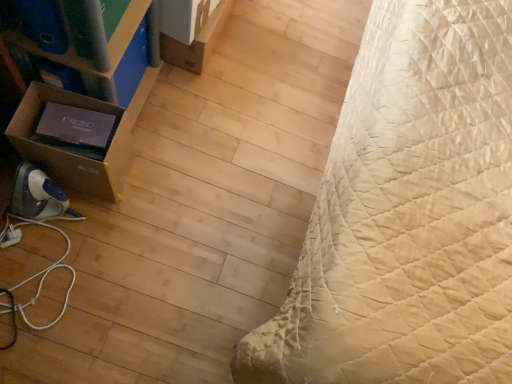
What do you see at coordinates (70, 149) in the screenshot?
I see `brown cardboard box at left, placed as the 1th cardboard box when sorted from front to back` at bounding box center [70, 149].

Where is `beige quilted bed at right`? Image resolution: width=512 pixels, height=384 pixels. beige quilted bed at right is located at coordinates (407, 214).

I want to click on brown cardboard box at left, arranged as the 1th cardboard box when ordered from the bottom, so click(x=70, y=149).

Considering the relative positions of matte cardboard box at left and brown cardboard box at left, placed as the second cardboard box when sorted from back to front, in the image provided, is matte cardboard box at left to the right of brown cardboard box at left, placed as the second cardboard box when sorted from back to front, from the viewer's perspective?

Correct, you'll find matte cardboard box at left to the right of brown cardboard box at left, placed as the second cardboard box when sorted from back to front.

From the picture: Which of these two, matte cardboard box at left or brown cardboard box at left, placed as the 1th cardboard box when sorted from front to back, stands taller?

Standing taller between the two is matte cardboard box at left.

Considering the points (16, 19) and (76, 182), which point is in front, point (16, 19) or point (76, 182)?

The point (16, 19) is closer.

Does beige quilted bed at right turn towards brown cardboard box at upper left, arranged as the first cardboard box when viewed from the top?

No, beige quilted bed at right is not aimed at brown cardboard box at upper left, arranged as the first cardboard box when viewed from the top.

Which object is wider, beige quilted bed at right or brown cardboard box at upper left, the 1th cardboard box when ordered from back to front?

beige quilted bed at right is wider.

Is beige quilted bed at right to the left of brown cardboard box at upper left, arranged as the first cardboard box when viewed from the top, from the viewer's perspective?

No, beige quilted bed at right is not to the left of brown cardboard box at upper left, arranged as the first cardboard box when viewed from the top.

From a real-world perspective, is beige quilted bed at right positioned under brown cardboard box at upper left, acting as the 2th cardboard box starting from the front, based on gravity?

No.

Is brown cardboard box at left, arranged as the second cardboard box when viewed from the right, smaller than matte cardboard box at left?

Yes, brown cardboard box at left, arranged as the second cardboard box when viewed from the right, is smaller than matte cardboard box at left.

Does brown cardboard box at left, placed as the 1th cardboard box when sorted from front to back, have a lesser width compared to matte cardboard box at left?

Yes, brown cardboard box at left, placed as the 1th cardboard box when sorted from front to back, is thinner than matte cardboard box at left.

Would you consider brown cardboard box at left, placed as the 1th cardboard box when sorted from front to back, to be distant from matte cardboard box at left?

No, brown cardboard box at left, placed as the 1th cardboard box when sorted from front to back, is not far from matte cardboard box at left.

From their relative heights in the image, would you say brown cardboard box at left, placed as the second cardboard box when sorted from back to front, is taller or shorter than matte cardboard box at left?

Clearly, brown cardboard box at left, placed as the second cardboard box when sorted from back to front, is shorter compared to matte cardboard box at left.

Which of these two, matte cardboard box at left or brown cardboard box at upper left, the 1th cardboard box when ordered from back to front, is smaller?

brown cardboard box at upper left, the 1th cardboard box when ordered from back to front.

Could you measure the distance between matte cardboard box at left and brown cardboard box at upper left, arranged as the 2th cardboard box when ordered from the bottom?

matte cardboard box at left and brown cardboard box at upper left, arranged as the 2th cardboard box when ordered from the bottom, are 14.30 inches apart.

Is point (25, 143) closer or farther from the camera than point (194, 55)?

Point (25, 143) is closer to the camera than point (194, 55).

Locate an element on the screen. cardboard box that is the 2nd one when counting backward from the matte cardboard box at left is located at coordinates (196, 42).

Is brown cardboard box at left, which appears as the 1th cardboard box when viewed from the left, not within brown cardboard box at upper left, the second cardboard box from the left?

Absolutely, brown cardboard box at left, which appears as the 1th cardboard box when viewed from the left, is external to brown cardboard box at upper left, the second cardboard box from the left.

Between brown cardboard box at left, which appears as the 1th cardboard box when viewed from the left, and brown cardboard box at upper left, arranged as the first cardboard box when viewed from the top, which one has larger size?

brown cardboard box at left, which appears as the 1th cardboard box when viewed from the left, is bigger.

Considering the sizes of brown cardboard box at left, arranged as the 1th cardboard box when ordered from the bottom, and brown cardboard box at upper left, arranged as the 2th cardboard box when ordered from the bottom, in the image, is brown cardboard box at left, arranged as the 1th cardboard box when ordered from the bottom, taller or shorter than brown cardboard box at upper left, arranged as the 2th cardboard box when ordered from the bottom,?

In the image, brown cardboard box at left, arranged as the 1th cardboard box when ordered from the bottom, appears to be taller than brown cardboard box at upper left, arranged as the 2th cardboard box when ordered from the bottom.

Considering the relative positions of brown cardboard box at left, placed as the second cardboard box when sorted from back to front, and brown cardboard box at upper left, acting as the 2th cardboard box starting from the front, in the image provided, is brown cardboard box at left, placed as the second cardboard box when sorted from back to front, behind brown cardboard box at upper left, acting as the 2th cardboard box starting from the front,?

No, brown cardboard box at left, placed as the second cardboard box when sorted from back to front, is in front of brown cardboard box at upper left, acting as the 2th cardboard box starting from the front.

In the image, is beige quilted bed at right on the left side or the right side of matte cardboard box at left?

beige quilted bed at right is to the right of matte cardboard box at left.

Is beige quilted bed at right positioned far away from matte cardboard box at left?

beige quilted bed at right is near matte cardboard box at left, not far away.

Where is `bed positioned vertically above the matte cardboard box at left (from a real-world perspective)`? This screenshot has width=512, height=384. bed positioned vertically above the matte cardboard box at left (from a real-world perspective) is located at coordinates (407, 214).

Which cardboard box is the 1st one when counting from the back of the beige quilted bed at right? Please provide its 2D coordinates.

[(70, 149)]

Is beige quilted bed at right in front of or behind brown cardboard box at left, acting as the second cardboard box starting from the top, in the image?

Clearly, beige quilted bed at right is in front of brown cardboard box at left, acting as the second cardboard box starting from the top.

From a real-world perspective, between beige quilted bed at right and brown cardboard box at left, placed as the 1th cardboard box when sorted from front to back, who is vertically higher?

From a 3D spatial view, beige quilted bed at right is above.

Does beige quilted bed at right appear on the left side of brown cardboard box at left, arranged as the 1th cardboard box when ordered from the bottom?

No.

Find the location of a particular element. the 1st cardboard box behind the matte cardboard box at left, counting from the anchor's position is located at coordinates (70, 149).

Locate an element on the screen. Image resolution: width=512 pixels, height=384 pixels. bed lying below the brown cardboard box at upper left, arranged as the first cardboard box when viewed from the top (from the image's perspective) is located at coordinates (407, 214).

Based on the photo, which object lies nearer to the anchor point matte cardboard box at left, brown cardboard box at upper left, the second cardboard box from the left, or beige quilted bed at right?

brown cardboard box at upper left, the second cardboard box from the left, is positioned closer to the anchor matte cardboard box at left.

Estimate the real-world distances between objects in this image. Which object is closer to matte cardboard box at left, beige quilted bed at right or brown cardboard box at upper left, arranged as the first cardboard box when viewed from the top?

Among the two, brown cardboard box at upper left, arranged as the first cardboard box when viewed from the top, is located nearer to matte cardboard box at left.

From the image, which object appears to be nearer to brown cardboard box at left, placed as the 1th cardboard box when sorted from front to back, matte cardboard box at left or beige quilted bed at right?

matte cardboard box at left is positioned closer to the anchor brown cardboard box at left, placed as the 1th cardboard box when sorted from front to back.

Estimate the real-world distances between objects in this image. Which object is further from matte cardboard box at left, brown cardboard box at left, placed as the 1th cardboard box when sorted from front to back, or brown cardboard box at upper left, the 1th cardboard box when ordered from back to front?

brown cardboard box at upper left, the 1th cardboard box when ordered from back to front, lies further to matte cardboard box at left than the other object.

Which object lies nearer to the anchor point matte cardboard box at left, beige quilted bed at right or brown cardboard box at left, placed as the 1th cardboard box when sorted from front to back?

Based on the image, brown cardboard box at left, placed as the 1th cardboard box when sorted from front to back, appears to be nearer to matte cardboard box at left.

When comparing their distances from brown cardboard box at upper left, arranged as the 2th cardboard box when ordered from the bottom, does beige quilted bed at right or matte cardboard box at left seem closer?

matte cardboard box at left is closer to brown cardboard box at upper left, arranged as the 2th cardboard box when ordered from the bottom.

Estimate the real-world distances between objects in this image. Which object is closer to beige quilted bed at right, brown cardboard box at upper left, acting as the 2th cardboard box starting from the front, or brown cardboard box at left, arranged as the 1th cardboard box when ordered from the bottom?

The object closer to beige quilted bed at right is brown cardboard box at left, arranged as the 1th cardboard box when ordered from the bottom.

Which object lies further to the anchor point brown cardboard box at upper left, the first cardboard box from the right, brown cardboard box at left, arranged as the 1th cardboard box when ordered from the bottom, or beige quilted bed at right?

Among the two, beige quilted bed at right is located further to brown cardboard box at upper left, the first cardboard box from the right.

Where is `furniture situated between brown cardboard box at left, which appears as the 1th cardboard box when viewed from the left, and beige quilted bed at right from left to right`? The width and height of the screenshot is (512, 384). furniture situated between brown cardboard box at left, which appears as the 1th cardboard box when viewed from the left, and beige quilted bed at right from left to right is located at coordinates (85, 88).

At what (x,y) coordinates should I click in order to perform the action: click on cardboard box positioned between matte cardboard box at left and brown cardboard box at upper left, the second cardboard box from the left, from near to far. Please return your answer as a coordinate pair (x, y). This screenshot has height=384, width=512. Looking at the image, I should click on (70, 149).

Locate an element on the screen. The height and width of the screenshot is (384, 512). cardboard box between matte cardboard box at left and beige quilted bed at right is located at coordinates (196, 42).

Where is `cardboard box situated between brown cardboard box at left, which appears as the 1th cardboard box when viewed from the left, and beige quilted bed at right from left to right`? The height and width of the screenshot is (384, 512). cardboard box situated between brown cardboard box at left, which appears as the 1th cardboard box when viewed from the left, and beige quilted bed at right from left to right is located at coordinates (196, 42).